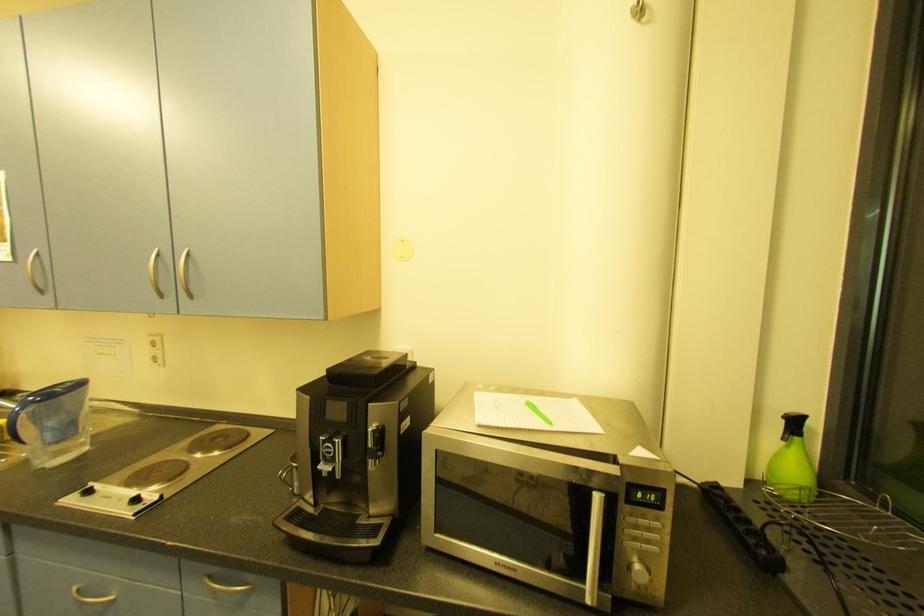
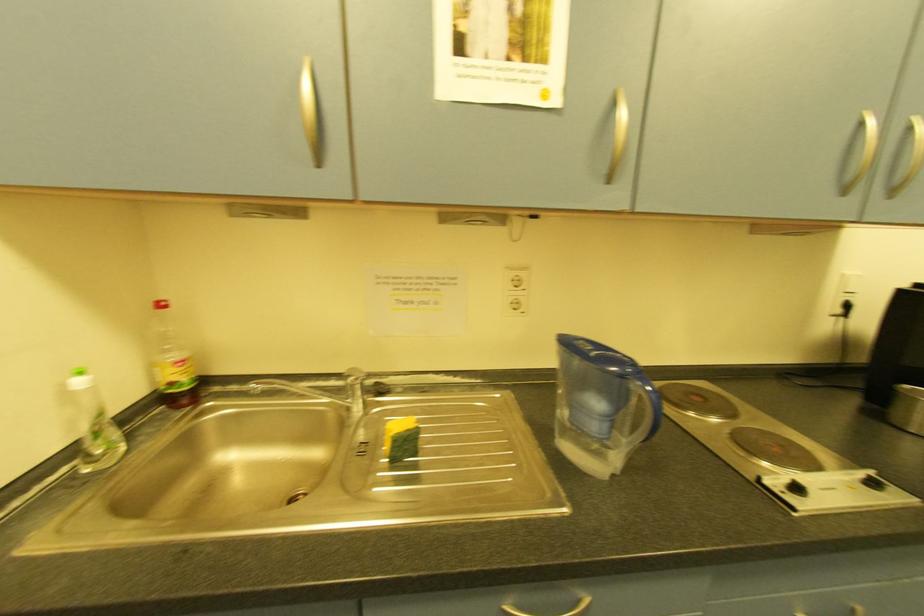
Question: What movement of the cameraman would produce the second image?

Choices:
 (A) Left
 (B) Right
 (C) Forward
 (D) Backward

Answer: (A)